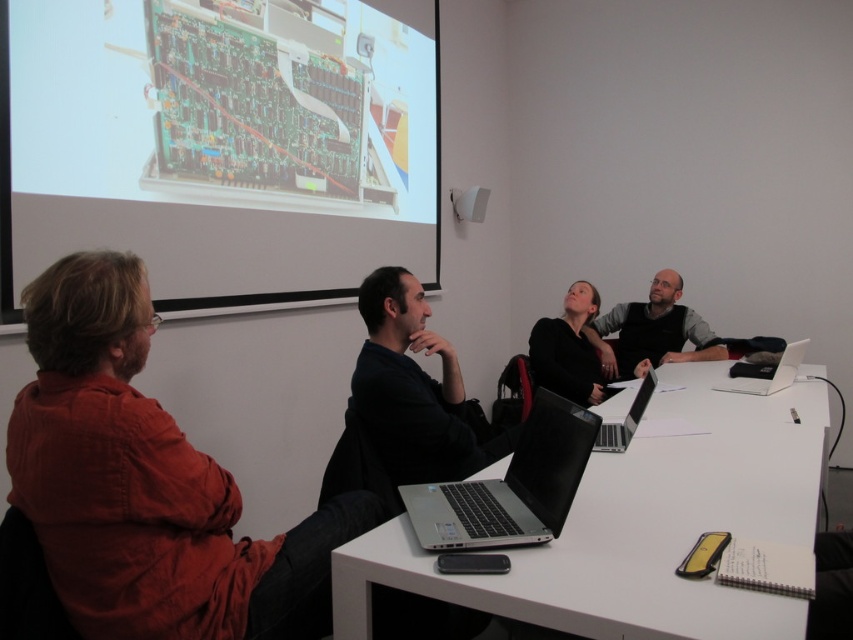
You are sitting at the white glossy table at center and want to reach the white glossy laptop at right. Is the laptop in front of you or behind you?

The white glossy laptop at right is behind you because the white glossy table at center is in front of it.

You are organizing a presentation and need to place a white glossy laptop at right on the white glossy table at center. Will the laptop fit entirely on the table without overhanging the edges?

The white glossy table at center is wider than the white glossy laptop at right, so the laptop will fit entirely on the table without overhanging the edges.